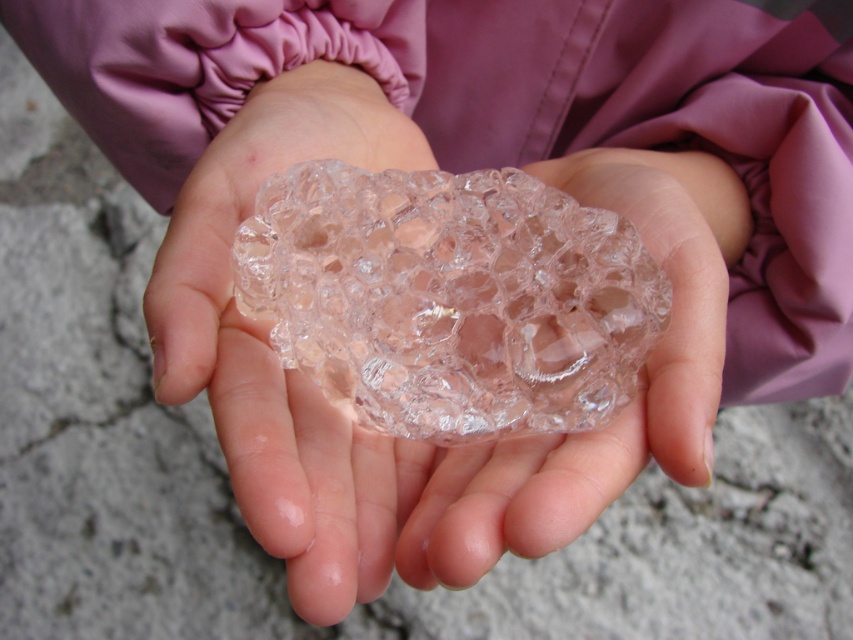
Is point (550, 481) more distant than point (422, 170)?

No, it is not.

Does transparent plastic rock at center have a lesser width compared to transparent glass crystal at center?

No, transparent plastic rock at center is not thinner than transparent glass crystal at center.

Is point (286, 483) behind point (451, 310)?

No.

Identify the location of transparent plastic rock at center. (403, 438).